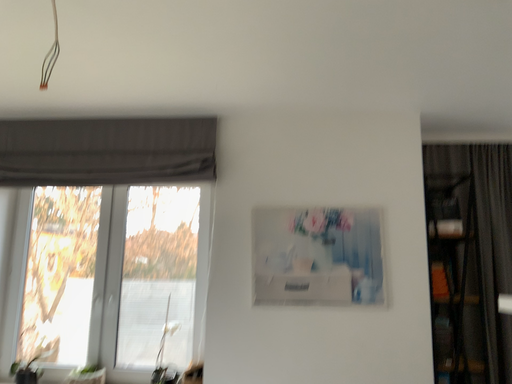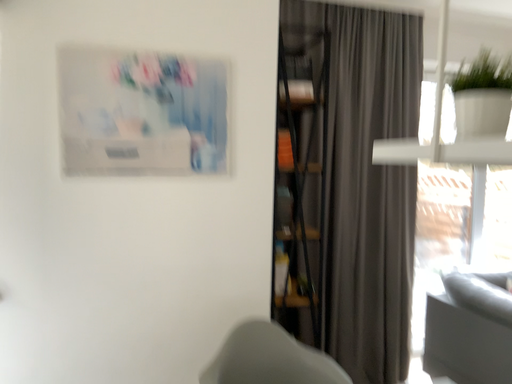
Question: Which way did the camera rotate in the video?

Choices:
 (A) rotated left
 (B) rotated right

Answer: (B)